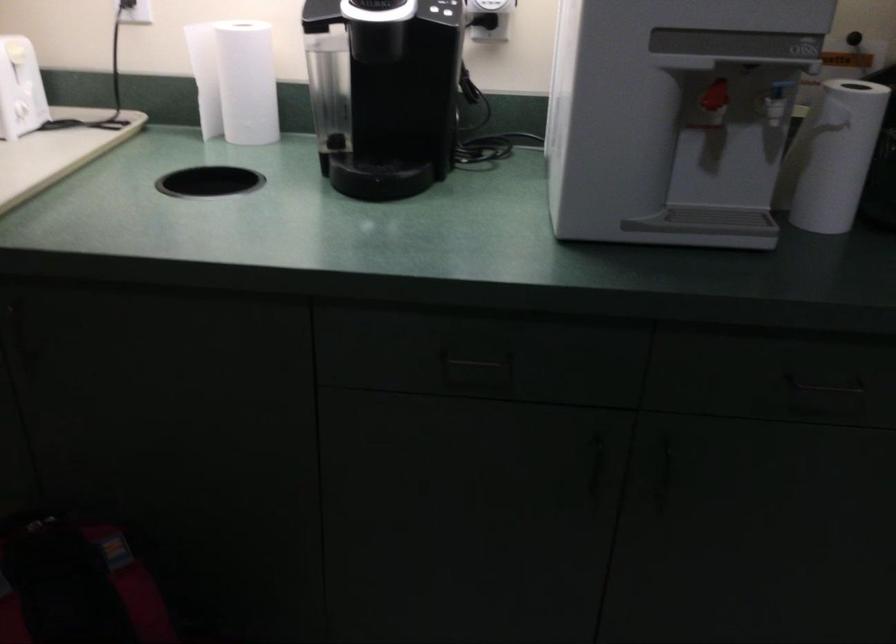
The first image is from the beginning of the video and the second image is from the end. How did the camera likely rotate when shooting the video?

The rotation direction of the camera is right-down.